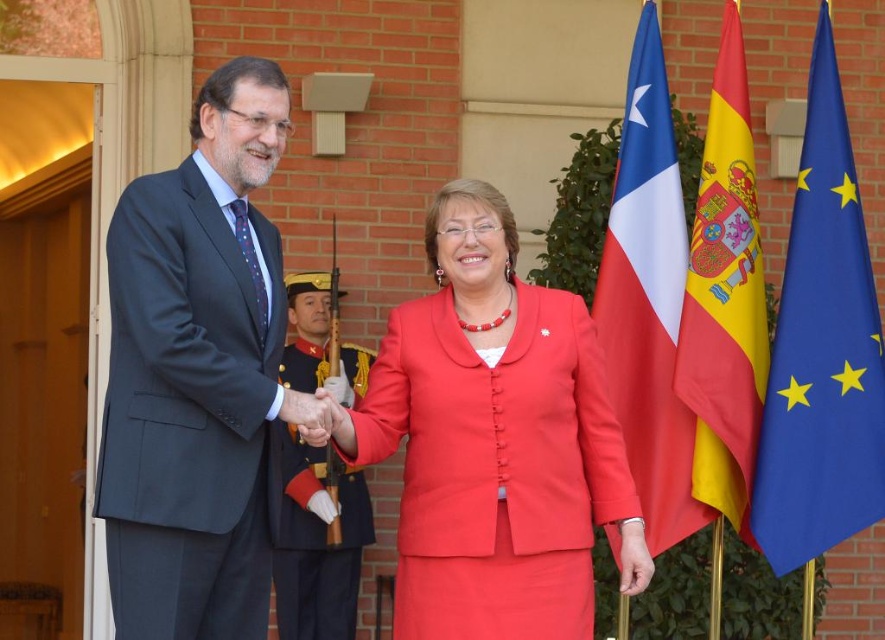
You are a photographer at the event and need to capture a photo where the white fabric flag at right is wider than the smooth skin hand at center. Is this possible based on the scene?

Yes, the white fabric flag at right is wider than the smooth skin hand at center, so capturing such a photo is possible.

You are attending this diplomatic meeting and need to place a new flag pole between the blue fabric flag at right and the white fabric flag at right. The new pole must be exactly halfway between them. Given their current heights, which flag should the new pole be closer to?

The blue fabric flag at right is taller than the white fabric flag at right. Since the new pole must be placed exactly halfway between them, it will be equidistant from both flags regardless of their heights. Therefore, the new pole will be equally close to both the blue fabric flag at right and the white fabric flag at right.